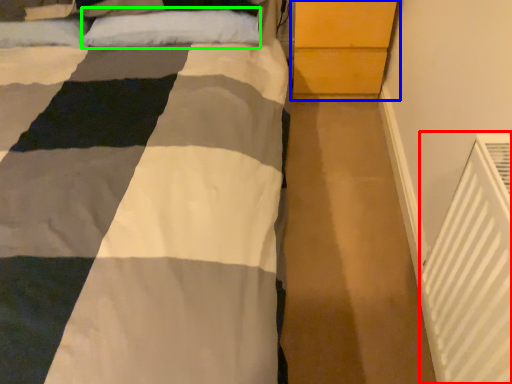
Question: Which is farther away from air conditioning (highlighted by a red box)? dresser (highlighted by a blue box) or pillow (highlighted by a green box)?

Choices:
 (A) dresser
 (B) pillow

Answer: (B)